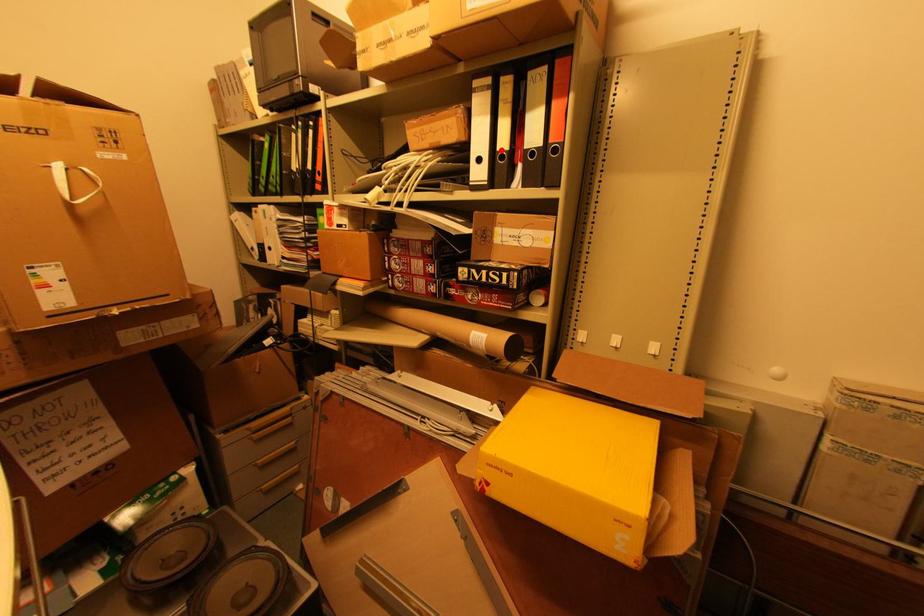
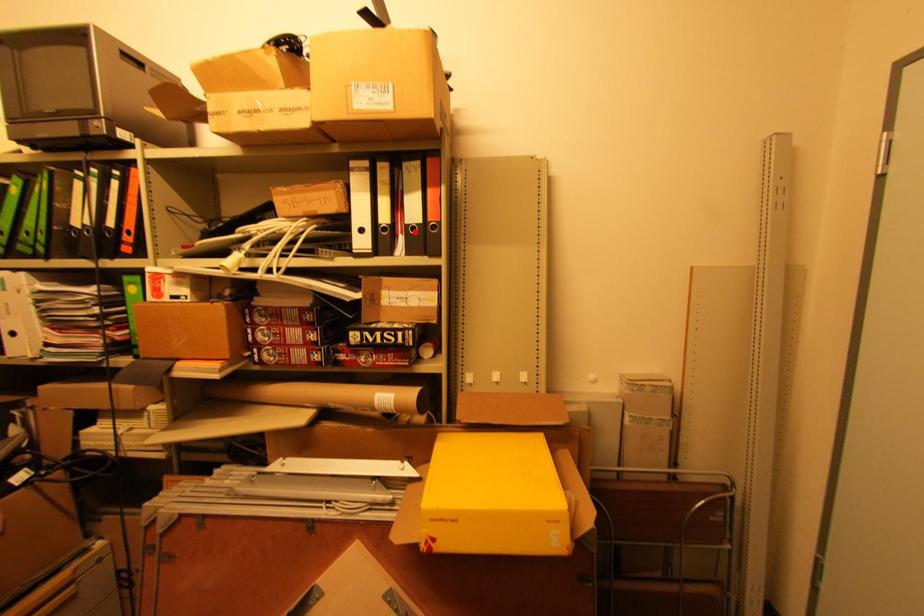
I am providing you with two images of the same scene from different viewpoints. A red point is marked on the first image and another point is marked on the second image. Does the point marked in image1 correspond to the same location as the one in image2?

No